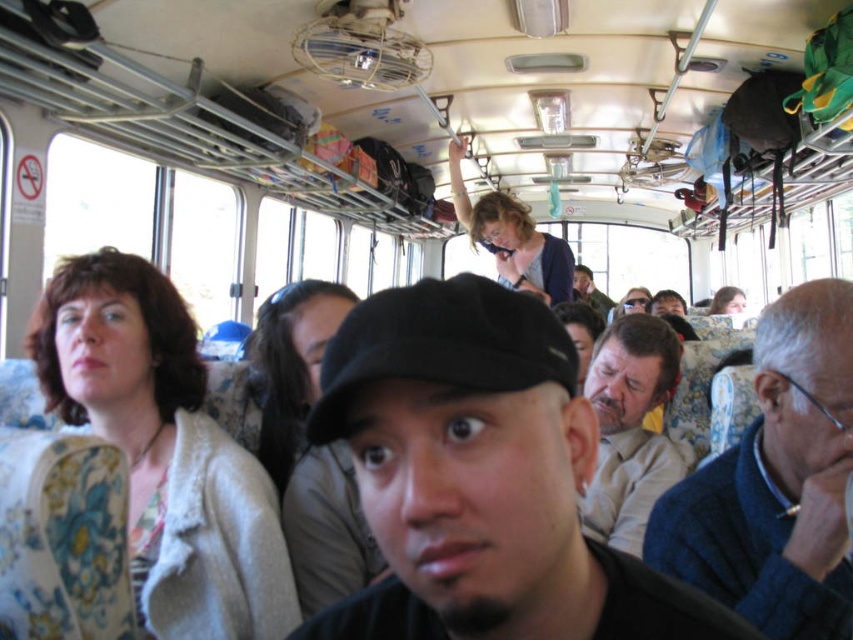
You are a delivery robot that is 2 feet wide. You need to move from the front of the bus to the back. There is a path between the black matte cap at center and the light beige shirt at center. Can you fit through that path?

The path between the black matte cap at center and the light beige shirt at center is 3.62 feet wide. Since the robot is 2 feet wide, it can fit through the path as the width is sufficient.

You are standing in the bus and want to take a photo of the point marked at coordinates point (173, 525). If your camera has a maximum focus range of 1.5 meters, will you be able to capture it clearly?

The point (173, 525) is 1.33 meters away from the camera, which is within the camera maximum focus range of 1.5 meters. So yes, you can capture it clearly.